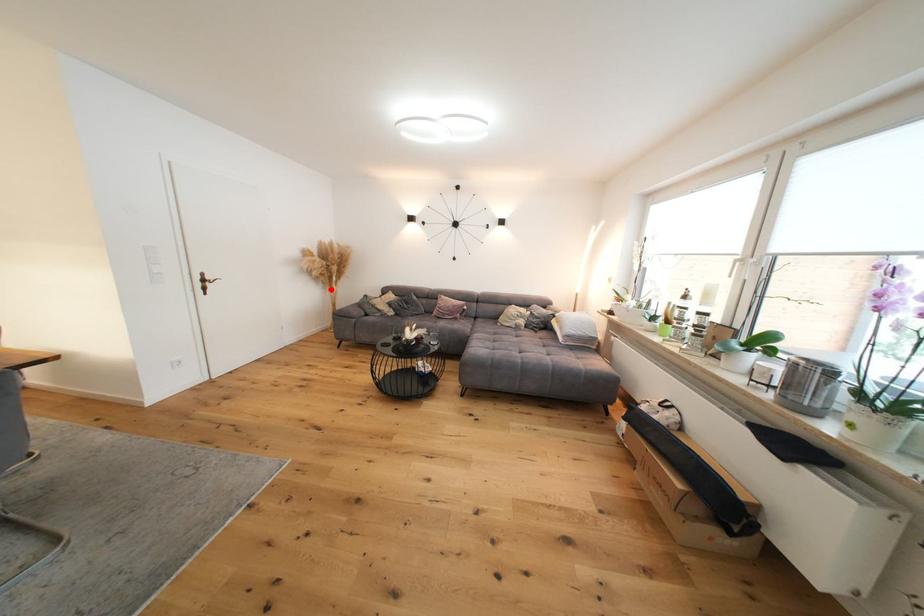
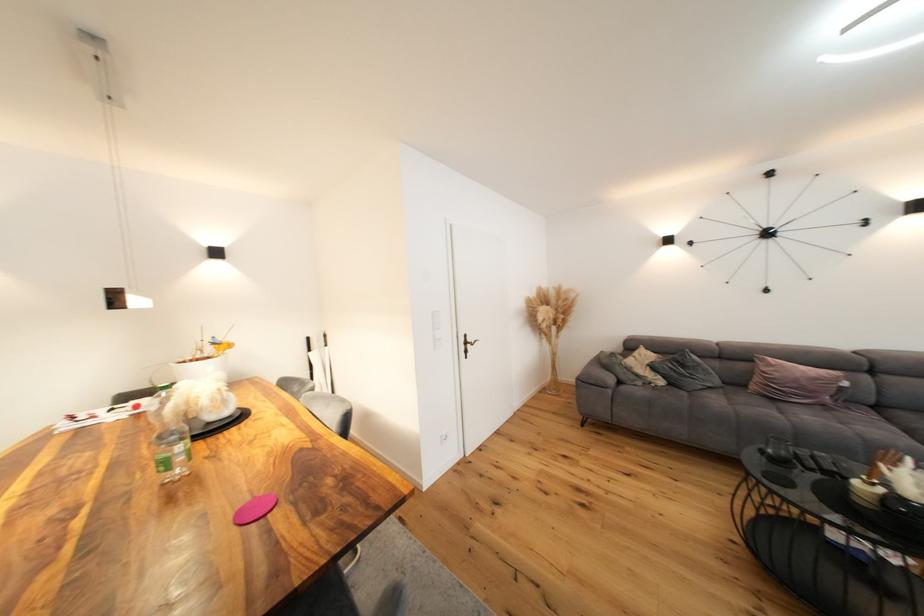
Find the pixel in the second image that matches the highlighted location in the first image.

(548, 342)